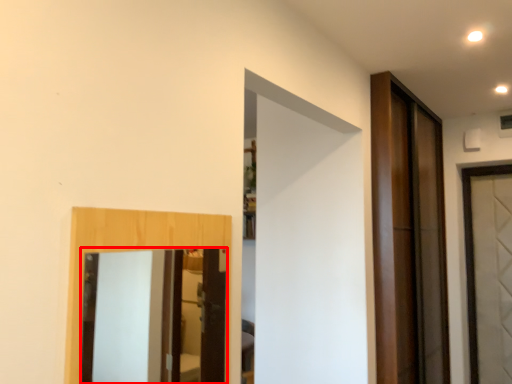
Question: Where is mirror (annotated by the red box) located in relation to door in the image?

Choices:
 (A) right
 (B) left

Answer: (B)